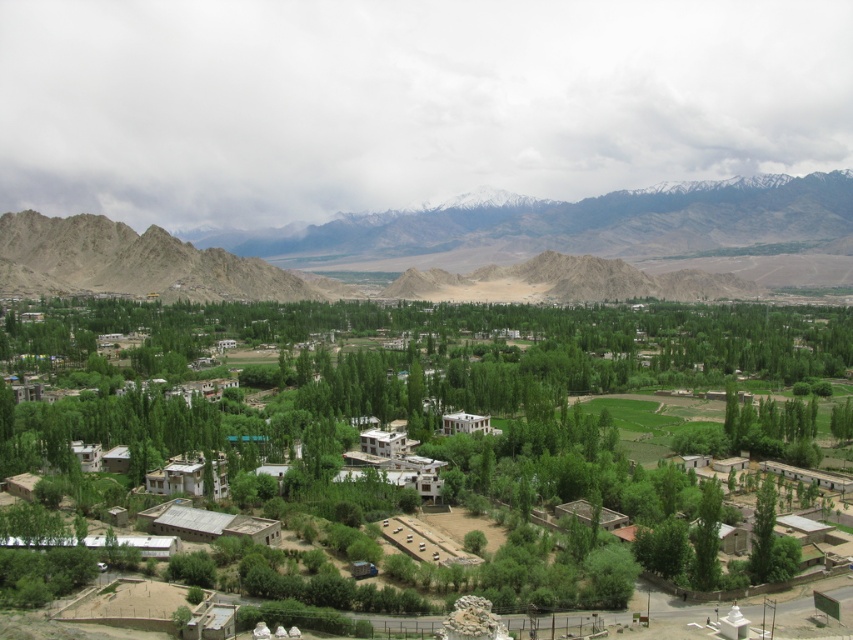
You are standing at the point with coordinates point [78,272] and want to reach the point with coordinates point [448,317]. Which direction should you move in to get there?

To reach point [448,317] from point [78,272], you should move forward since point [448,317] is in front of point [78,272].

You are standing in the valley and want to take a photo of the rugged brown mountains at upper center without the green leafy tree at center blocking the view. Which direction should you move to ensure the tree is no longer in the way?

The green leafy tree at center is to the left of the rugged brown mountains at upper center. To avoid the tree blocking the view, you should move to the right side of the tree so that the mountains are now to your left and the tree is no longer obstructing the view.